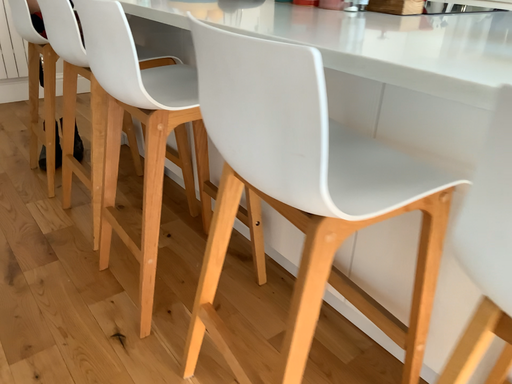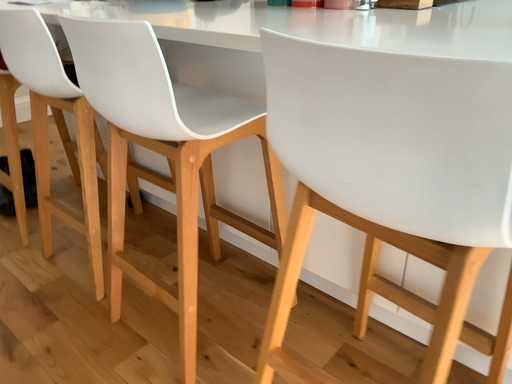
Question: How did the camera likely rotate when shooting the video?

Choices:
 (A) rotated left
 (B) rotated right

Answer: (B)